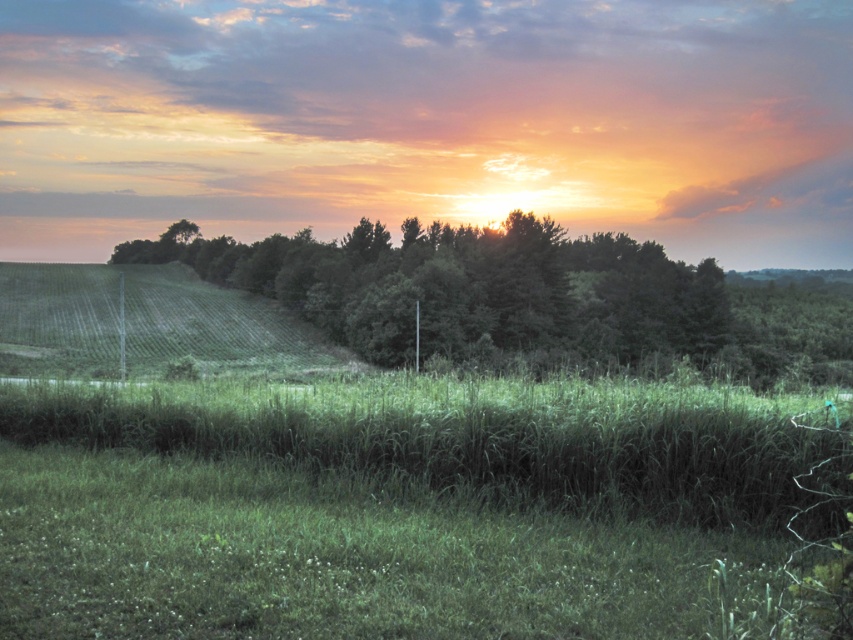
You are standing in the meadow and want to walk to the green grassy hillside at left. Which direction should you walk relative to the green leafy trees at center?

The green grassy hillside at left is behind the green leafy trees at center, so you should walk towards the direction away from the green leafy trees at center to reach it.

You are standing in the middle of the green grassy at center and want to walk towards the green grassy hillside at left. Which direction should you head to get closer to the hillside?

Since the green grassy at center is closer to the viewer than the green grassy hillside at left, you should head towards the left direction to move closer to the green grassy hillside at left.